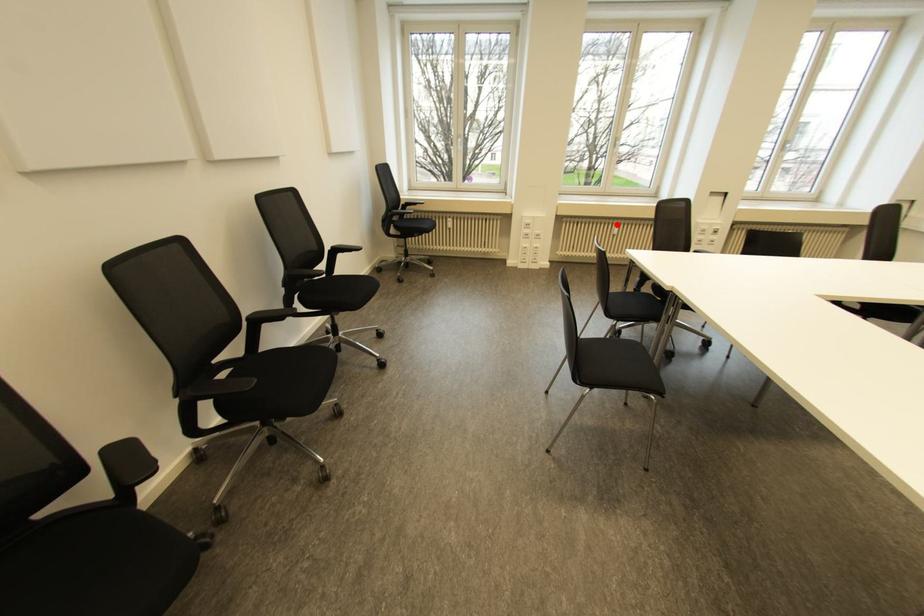
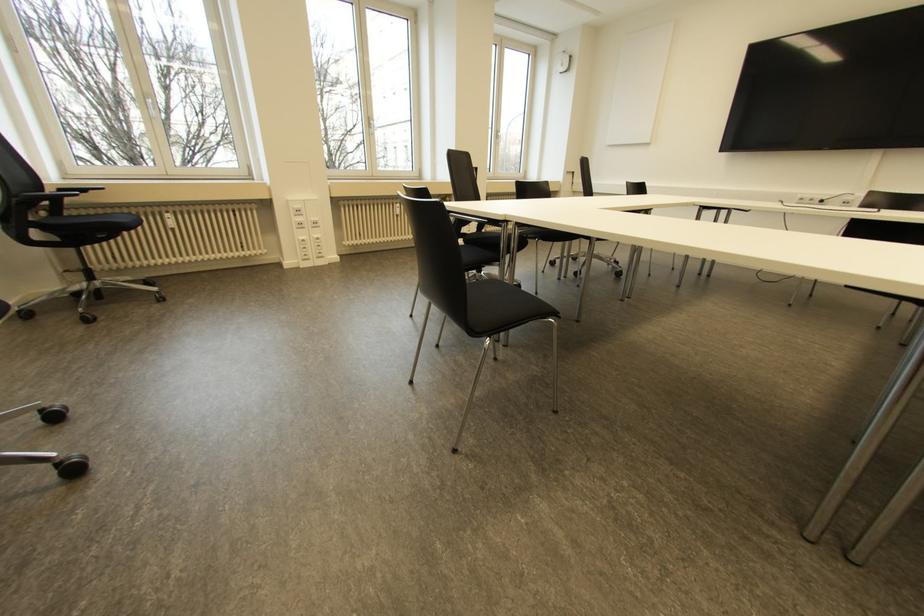
Locate, in the second image, the point that corresponds to the highlighted location in the first image.

(397, 204)